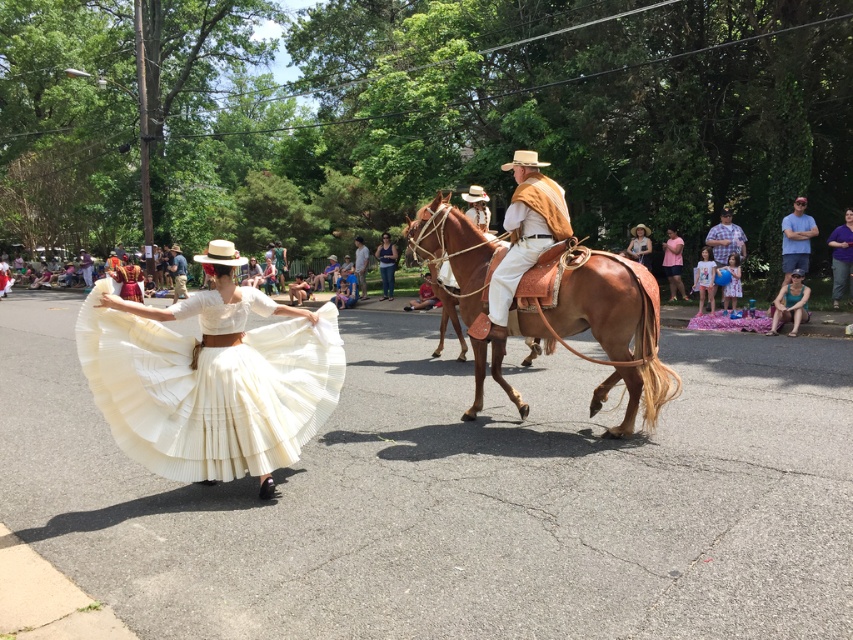
You are a photographer at the event, and you need to capture a photo that includes both the white pleated skirt at center and the checkered fabric shirt at right. Which object should you focus on first to ensure both are in frame?

You should focus on the white pleated skirt at center first because it is closer to the viewer than the checkered fabric shirt at right, so adjusting the focus from near to far will help capture both in the frame.

You are a photographer trying to capture the entire scene in one shot. The white pleated skirt at center and the brown leather horse at center are both in the frame. Based on their sizes, which object would require you to adjust your camera angle more to ensure both are fully visible?

The white pleated skirt at center might be wider than brown leather horse at center, so you might need to adjust your camera angle more to accommodate the width of the white pleated skirt at center.

You are a photographer at the event and want to capture both the pink cotton dress at center and the dark blue denim jeans at center in a single frame. Which one should you position your camera to the left of to include both?

To include both the pink cotton dress at center and the dark blue denim jeans at center in a single frame, position your camera to the left of the pink cotton dress at center, since it is to the right of the dark blue denim jeans at center.